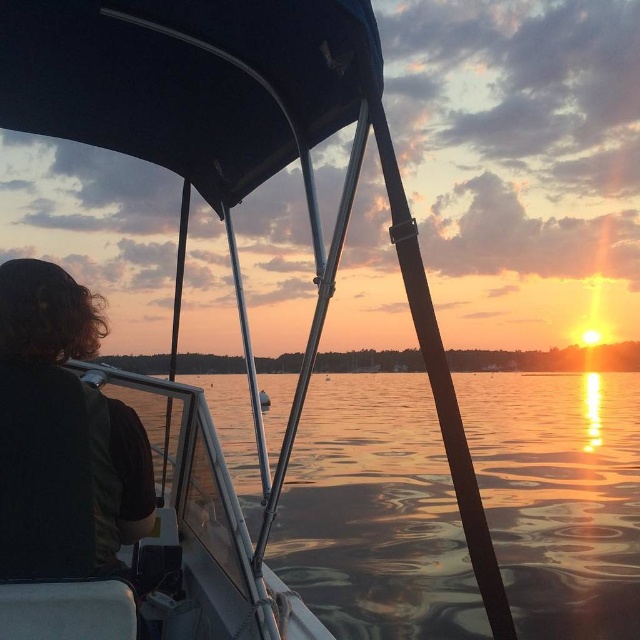
You are a photographer standing on the boat and want to take a photo of the glistening water at center and the dark brown hair at left. The camera you have can focus on objects within a 5 meter range. Can you capture both subjects in focus without moving the camera?

The glistening water at center and dark brown hair at left are 5.11 meters apart. Since the camera can only focus within 5 meters, the distance between them exceeds the camera range, so you cannot capture both in focus without moving the camera.

You are a passenger sitting in the boat and want to look at the sunset. Which object is closer to your left side, the glistening water at center or the dark brown hair at left?

The dark brown hair at left is closer to your left side because it is positioned to the left of the glistening water at center.

You are a passenger on the boat and want to take a photo of the sunset. You notice the dark brown hair at left and the glistening water at center. Which object should you adjust to ensure the sunset is clearly visible in your photo?

You should adjust the dark brown hair at left because it is behind the glistening water at center and might block the view of the sunset.